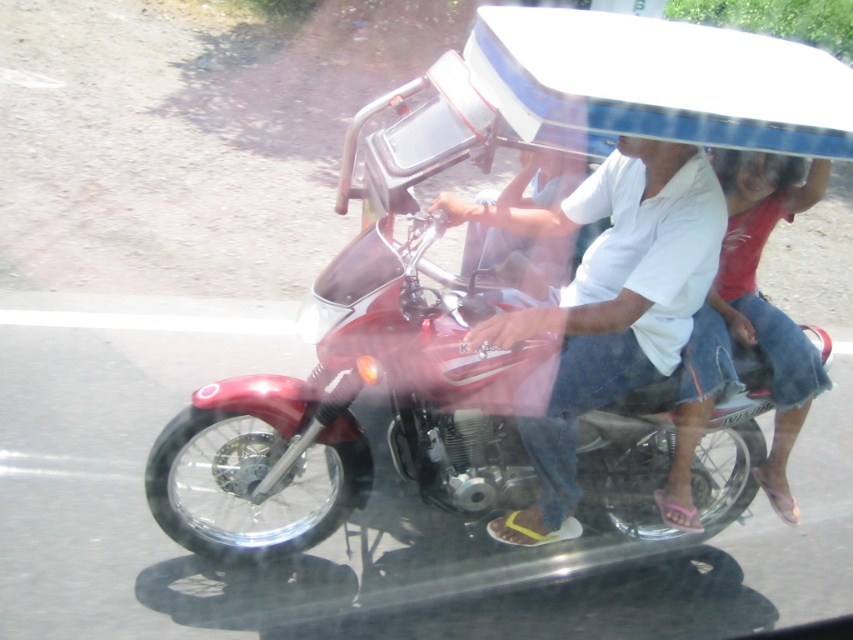
Between point (357, 356) and point (735, 179), which one is positioned behind?

The point (735, 179) is more distant.

Can you confirm if metallic red motorcycle at center is positioned above denim shorts at center?

Yes, metallic red motorcycle at center is above denim shorts at center.

What do you see at coordinates (358, 378) in the screenshot? I see `metallic red motorcycle at center` at bounding box center [358, 378].

Find the location of a particular element. The width and height of the screenshot is (853, 640). metallic red motorcycle at center is located at coordinates (358, 378).

Who is positioned more to the right, metallic red motorcycle at center or white cotton shirt at center?

Positioned to the right is white cotton shirt at center.

Does metallic red motorcycle at center appear on the left side of white cotton shirt at center?

Correct, you'll find metallic red motorcycle at center to the left of white cotton shirt at center.

Is point (665, 412) farther from viewer compared to point (612, 288)?

That is True.

What are the coordinates of `metallic red motorcycle at center` in the screenshot? It's located at (358, 378).

This screenshot has height=640, width=853. Identify the location of white cotton shirt at center. (602, 301).

Does point (527, 515) come farther from viewer compared to point (683, 356)?

Yes, it is.

Who is more distant from viewer, (666, 228) or (724, 240)?

Positioned behind is point (724, 240).

I want to click on white cotton shirt at center, so click(602, 301).